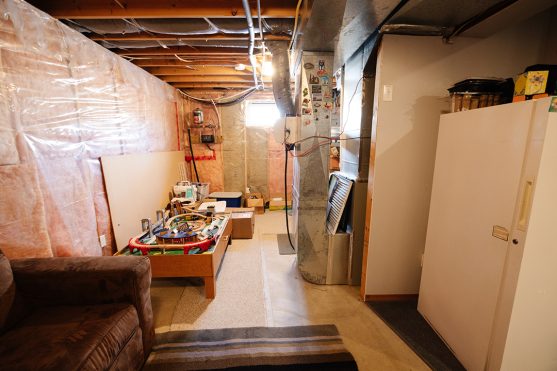
Where is `basement light`? basement light is located at coordinates (266, 64).